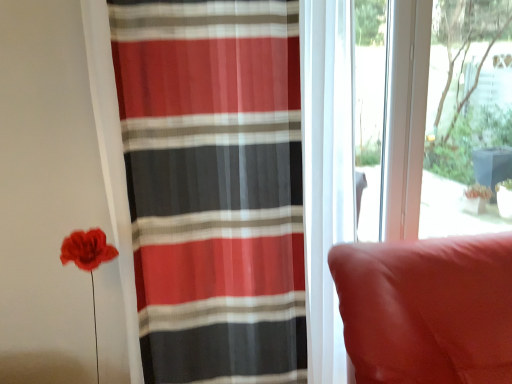
Question: Considering the relative sizes of striped sheer curtain at left and transparent glass window screen at upper right in the image provided, is striped sheer curtain at left shorter than transparent glass window screen at upper right?

Choices:
 (A) no
 (B) yes

Answer: (A)

Question: Is the position of striped sheer curtain at left less distant than that of transparent glass window screen at upper right?

Choices:
 (A) no
 (B) yes

Answer: (B)

Question: From a real-world perspective, does striped sheer curtain at left stand above transparent glass window screen at upper right?

Choices:
 (A) no
 (B) yes

Answer: (A)

Question: Considering the relative sizes of striped sheer curtain at left and transparent glass window screen at upper right in the image provided, is striped sheer curtain at left taller than transparent glass window screen at upper right?

Choices:
 (A) yes
 (B) no

Answer: (A)

Question: Is striped sheer curtain at left oriented away from transparent glass window screen at upper right?

Choices:
 (A) no
 (B) yes

Answer: (A)

Question: Is striped sheer curtain at left in front of or behind transparent glass window screen at upper right in the image?

Choices:
 (A) behind
 (B) front

Answer: (B)

Question: From their relative heights in the image, would you say striped sheer curtain at left is taller or shorter than transparent glass window screen at upper right?

Choices:
 (A) short
 (B) tall

Answer: (B)

Question: From the image's perspective, relative to transparent glass window screen at upper right, is striped sheer curtain at left above or below?

Choices:
 (A) above
 (B) below

Answer: (B)

Question: In the image, is striped sheer curtain at left on the left side or the right side of transparent glass window screen at upper right?

Choices:
 (A) right
 (B) left

Answer: (B)

Question: Is transparent glass window screen at upper right in front of or behind suede-like red cushion at right in the image?

Choices:
 (A) behind
 (B) front

Answer: (A)

Question: From a real-world perspective, is transparent glass window screen at upper right above or below suede-like red cushion at right?

Choices:
 (A) below
 (B) above

Answer: (B)

Question: Is point (508, 221) closer or farther from the camera than point (357, 382)?

Choices:
 (A) closer
 (B) farther

Answer: (B)

Question: Considering the relative positions of transparent glass window screen at upper right and suede-like red cushion at right in the image provided, is transparent glass window screen at upper right to the left or to the right of suede-like red cushion at right?

Choices:
 (A) left
 (B) right

Answer: (B)

Question: Considering the positions of point (426, 372) and point (189, 177), is point (426, 372) closer or farther from the camera than point (189, 177)?

Choices:
 (A) closer
 (B) farther

Answer: (A)

Question: Is suede-like red cushion at right inside the boundaries of striped sheer curtain at left, or outside?

Choices:
 (A) inside
 (B) outside

Answer: (B)